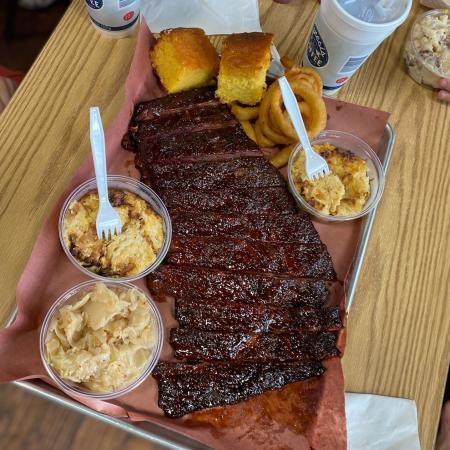
At what (x,y) coordinates should I click in order to perform the action: click on wooden table. Please return your answer as a coordinate pair (x, y). Looking at the image, I should click on (434, 236).